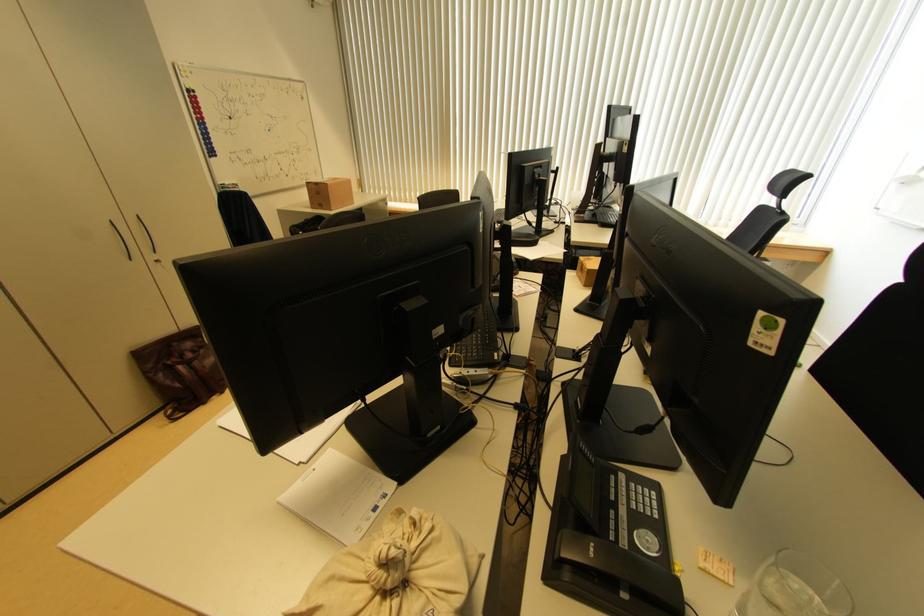
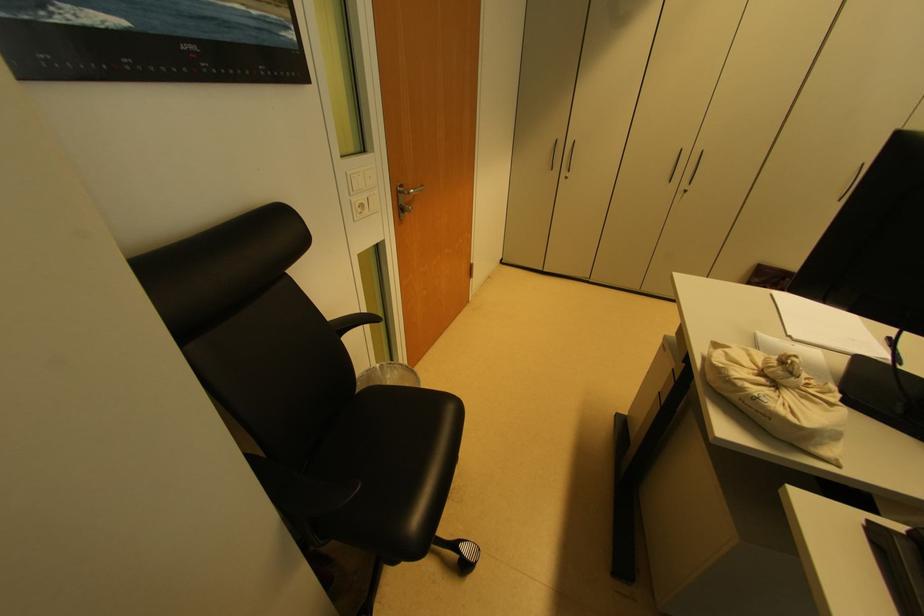
Based on the continuous images, in which direction is the camera rotating?

The camera rotated toward left-down.